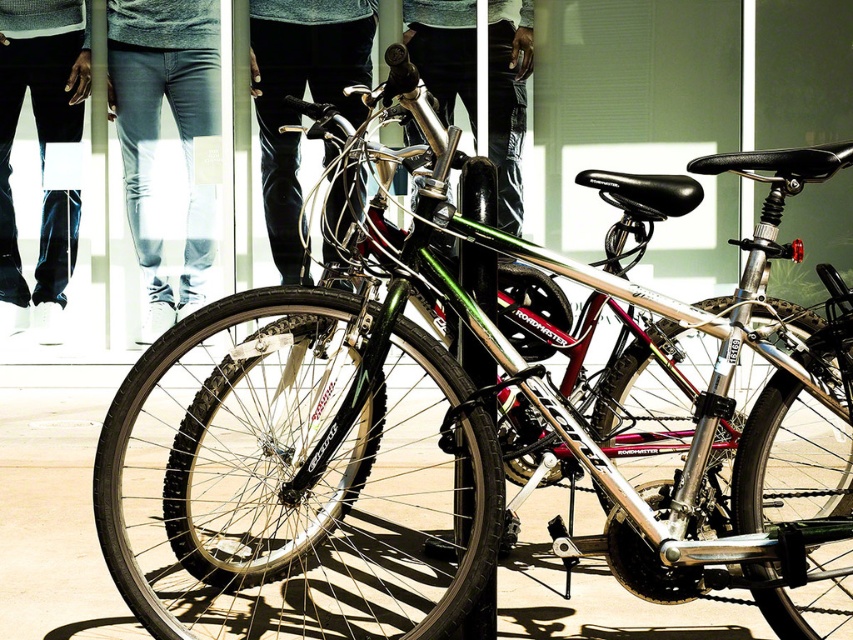
Can you confirm if dark blue jeans at lower left is positioned below metallic silver bicycle at center?

Indeed, dark blue jeans at lower left is positioned under metallic silver bicycle at center.

Measure the distance between dark blue jeans at lower left and camera.

dark blue jeans at lower left is 7.10 meters away from camera.

You are a GUI agent. You are given a task and a screenshot of the screen. Output one action in this format:
    pyautogui.click(x=<x>, y=<y>)
    Task: Click on the dark blue jeans at lower left
    The image size is (853, 640).
    Given the screenshot: What is the action you would take?
    pyautogui.click(x=42, y=141)

Is point (344, 72) closer to camera compared to point (50, 278)?

Yes.

Is black leather pants at center closer to the viewer compared to dark blue jeans at lower left?

Yes.

Is point (361, 108) in front of point (4, 84)?

That is False.

Image resolution: width=853 pixels, height=640 pixels. In order to click on black leather pants at center in this screenshot , I will do `click(300, 97)`.

Is smooth concrete pavement at center positioned behind denim jeans at center?

That is False.

Can you confirm if smooth concrete pavement at center is wider than denim jeans at center?

Yes, smooth concrete pavement at center is wider than denim jeans at center.

Who is more distant from viewer, (x=585, y=632) or (x=113, y=54)?

Positioned behind is point (x=113, y=54).

Find the location of a particular element. This screenshot has height=640, width=853. smooth concrete pavement at center is located at coordinates (54, 504).